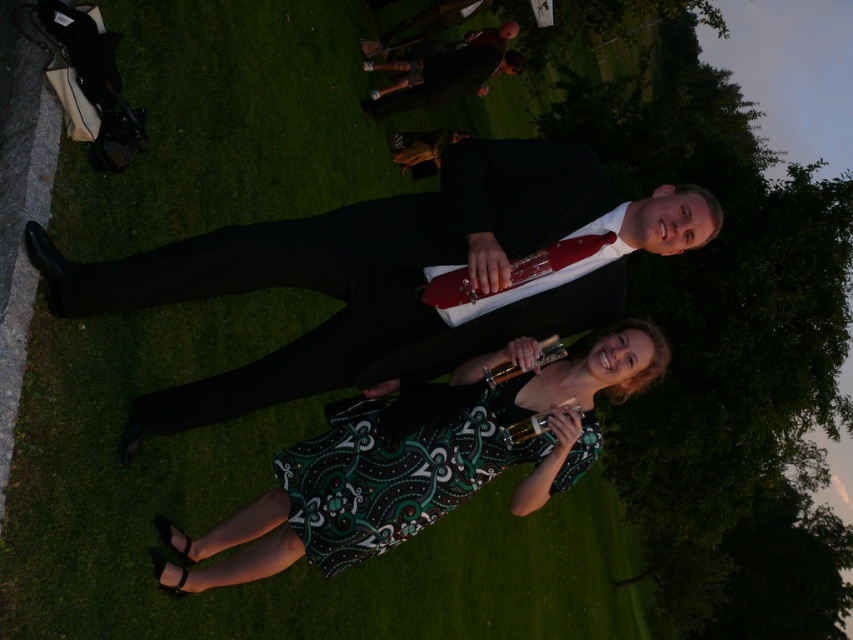
You are a photographer at a formal event. You need to capture a photo of the printed fabric dress at center and the green paisley fabric dress at center. Which dress should you focus on first if you want to include both in the frame without moving the camera?

The printed fabric dress at center is above the green paisley fabric dress at center, so you should focus on the printed fabric dress at center first to ensure both are in the frame.

You are standing at the origin point of the image. Where is the green paisley fabric dress at center located?

The green paisley fabric dress at center is located at point (396, 472).